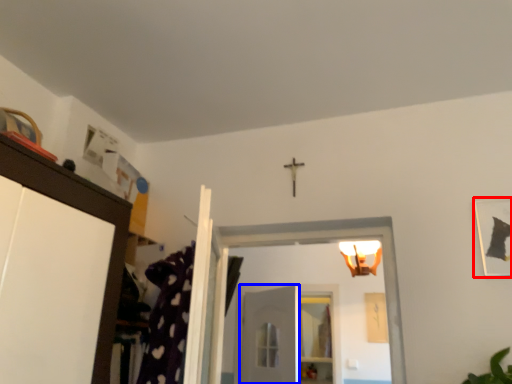
Question: Among these objects, which one is farthest to the camera, picture frame (highlighted by a red box) or door (highlighted by a blue box)?

Choices:
 (A) picture frame
 (B) door

Answer: (B)